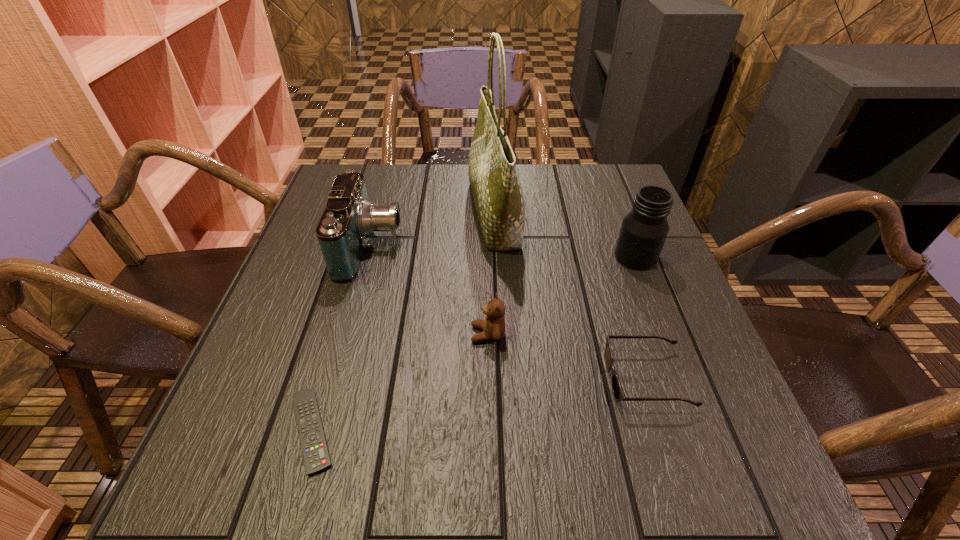
Identify the location of free space between the shortest object and the teddy bear. The width and height of the screenshot is (960, 540). [x=400, y=382].

Find the location of a particular element. free spot between the teddy bear and the tallest object is located at coordinates (491, 274).

The width and height of the screenshot is (960, 540). Identify the location of vacant area that lies between the third tallest object and the shopping bag. (433, 230).

Find the location of a particular element. blank region between the second shortest object and the tallest object is located at coordinates (570, 296).

You are a GUI agent. You are given a task and a screenshot of the screen. Output one action in this format:
    pyautogui.click(x=<x>, y=<y>)
    Task: Click on the unoccupied position between the jar and the fourth shortest object
    
    Given the screenshot: What is the action you would take?
    pyautogui.click(x=503, y=252)

Identify the location of empty space that is in between the teddy bear and the tallest object. (491, 274).

Locate an element on the screen. This screenshot has height=540, width=960. unoccupied position between the third shortest object and the camcorder is located at coordinates (429, 291).

Identify which object is the fifth nearest to the tallest object. Please provide its 2D coordinates. Your answer should be formatted as a tuple, i.e. [(x, y)], where the tuple contains the x and y coordinates of a point satisfying the conditions above.

[(316, 456)]

Identify which object is located as the fifth nearest to the tallest object. Please provide its 2D coordinates. Your answer should be formatted as a tuple, i.e. [(x, y)], where the tuple contains the x and y coordinates of a point satisfying the conditions above.

[(316, 456)]

This screenshot has height=540, width=960. Identify the location of blank area in the image that satisfies the following two spatial constraints: 1. on the front side of the jar; 2. on the front lenses of the fifth tallest object. (683, 379).